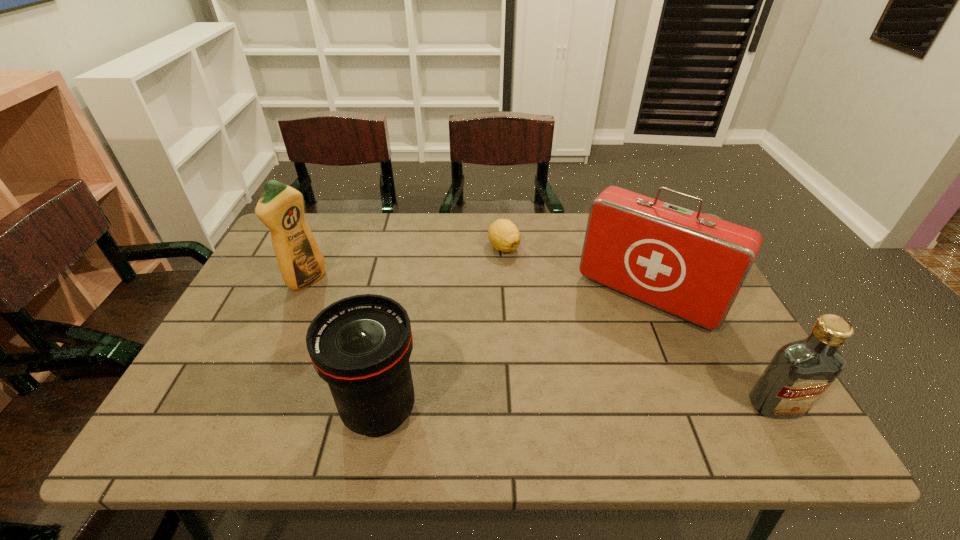
The width and height of the screenshot is (960, 540). I want to click on telephoto lens, so click(x=360, y=345).

At what (x,y) coordinates should I click in order to perform the action: click on vodka. Please return your answer as a coordinate pair (x, y). This screenshot has height=540, width=960. Looking at the image, I should click on (800, 372).

Where is `the leftmost object`? the leftmost object is located at coordinates (280, 207).

Where is `the first-aid kit`? the first-aid kit is located at coordinates (692, 265).

This screenshot has width=960, height=540. What are the coordinates of `the farthest object` in the screenshot? It's located at (504, 236).

At what (x,y) coordinates should I click in order to perform the action: click on lemon. Please return your answer as a coordinate pair (x, y). This screenshot has height=540, width=960. Looking at the image, I should click on (504, 236).

You are a GUI agent. You are given a task and a screenshot of the screen. Output one action in this format:
    pyautogui.click(x=<x>, y=<y>)
    Task: Click on the vacant space located on the back of the fourth object from right to left
    Image resolution: width=960 pixels, height=540 pixels.
    Given the screenshot: What is the action you would take?
    pyautogui.click(x=401, y=296)

Find the location of `vacant region located on the label of the detergent`. vacant region located on the label of the detergent is located at coordinates (387, 323).

The height and width of the screenshot is (540, 960). Find the location of `free space located 0.330m on the label of the detergent`. free space located 0.330m on the label of the detergent is located at coordinates (411, 335).

Identify the location of vacant region located 0.090m on the label of the detergent. This screenshot has width=960, height=540. (342, 299).